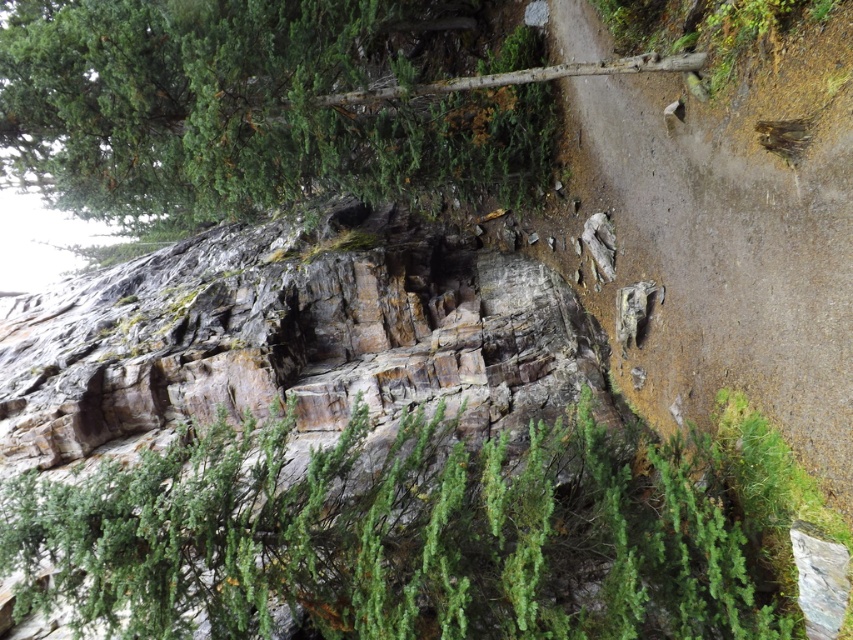
You are standing at the center of the dirt path in the rugged outdoor scene. You notice a green textured tree at upper left. Can you determine its exact location in terms of coordinates?

The green textured tree at upper left is located at coordinates point [263,104].